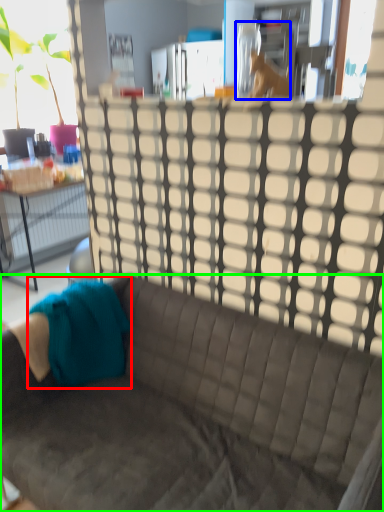
Question: Which object is the closest to the fabric (highlighted by a red box)? Choose among these: animal (highlighted by a blue box) or studio couch (highlighted by a green box).

Choices:
 (A) animal
 (B) studio couch

Answer: (B)